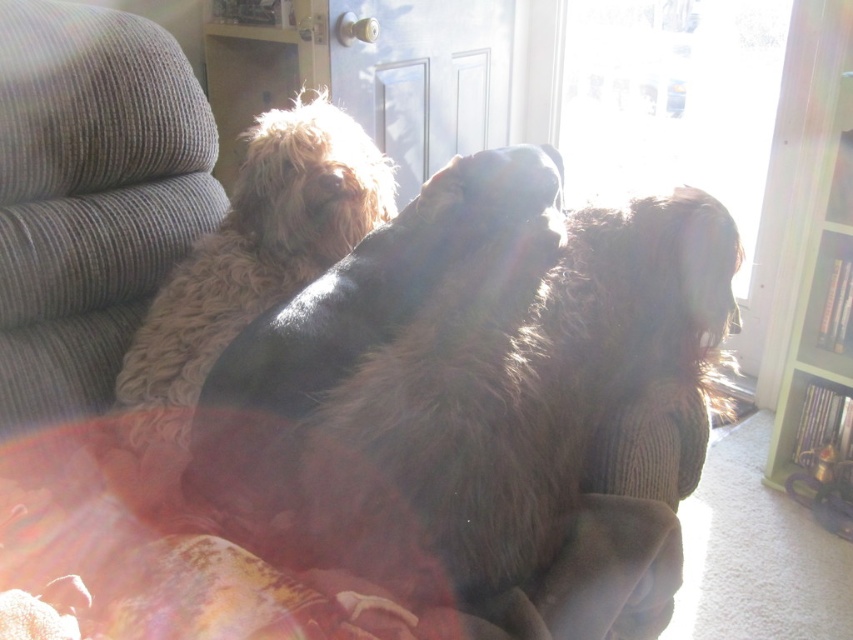
You are a visitor in this room and want to take a photo of the fuzzy brown dog at center without including the green painted wood bookshelf at right in the frame. Which direction should you move to achieve this?

Move to the right side of the room so that the green painted wood bookshelf at right is out of the frame while keeping the fuzzy brown dog at center in view.

You are a dog owner who wants to buy a new blanket for your dogs. The current blanket is too small for the fuzzy brown dog at center but fits the fluffy beige dog at upper left. Which dog requires a larger blanket?

The fuzzy brown dog at center requires a larger blanket because it is bigger than the fluffy beige dog at upper left.